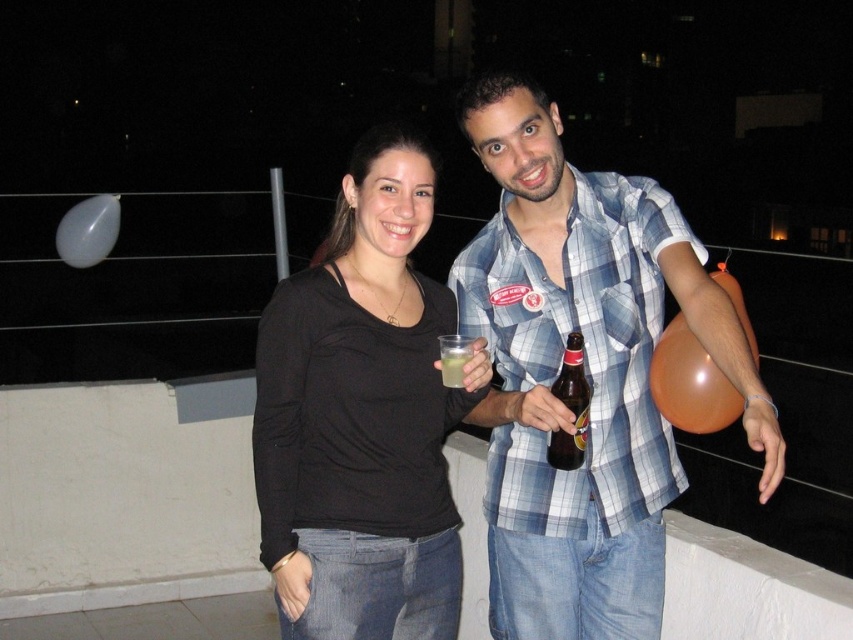
Looking at this image, you are at a party and want to talk to the person wearing the black matte shirt at center. Which direction should you move relative to the blue plaid shirt at center?

The blue plaid shirt at center is in front of the black matte shirt at center, so you should move behind the blue plaid shirt at center to reach the black matte shirt at center.

You are at a rooftop party and want to grab the orange rubber balloon at right. Where should you look to find it?

The orange rubber balloon at right is located at point (x=689, y=381).